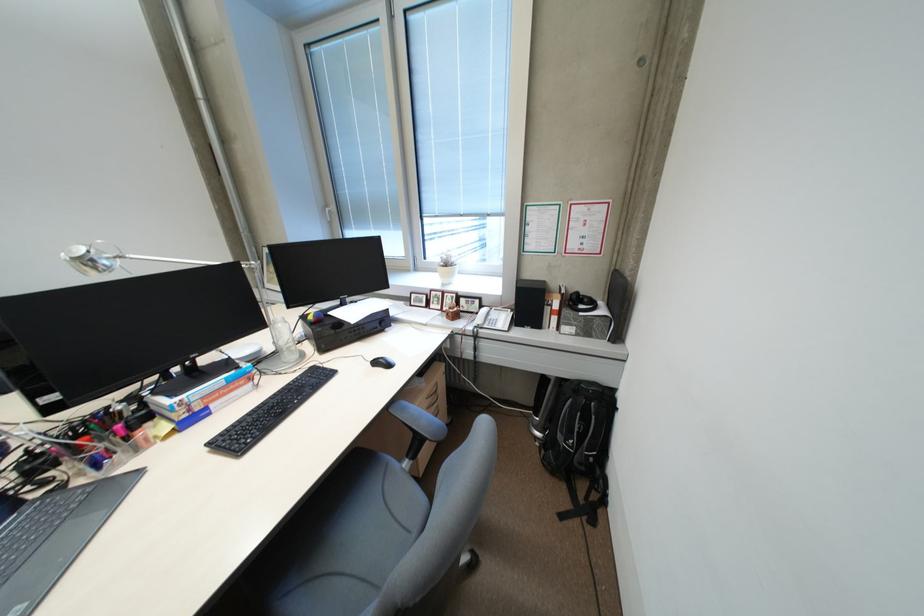
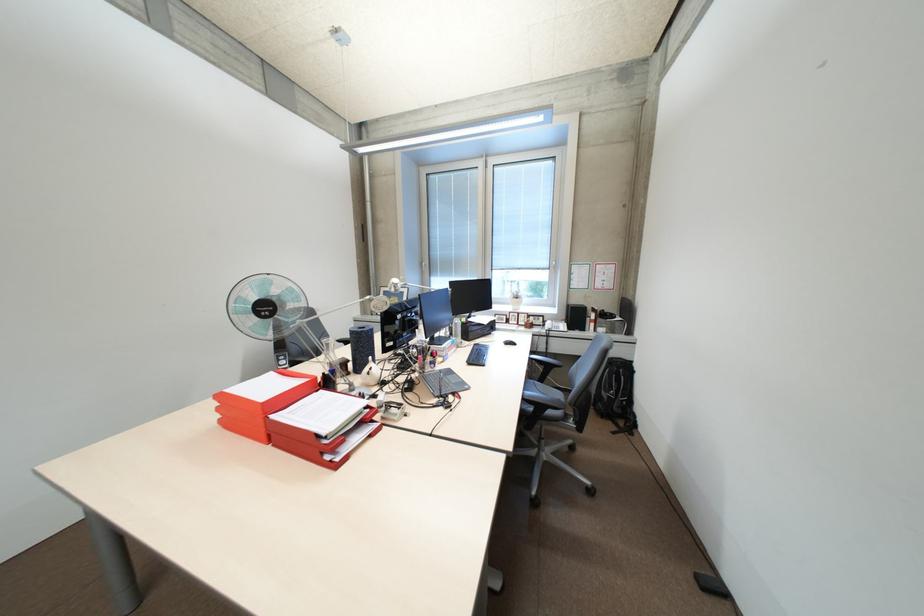
Where in the second image is the point corresponding to the point at 592,474 from the first image?

(630, 416)